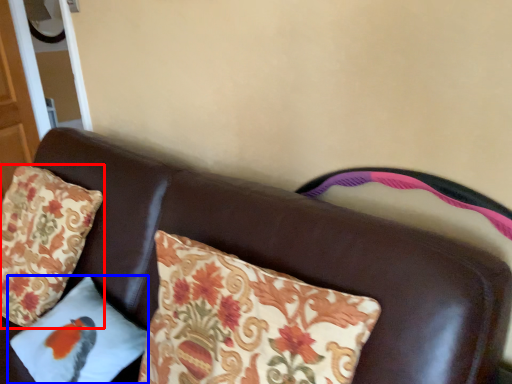
Question: Which object appears farthest to the camera in this image, pillow (highlighted by a red box) or pillow (highlighted by a blue box)?

Choices:
 (A) pillow
 (B) pillow

Answer: (A)